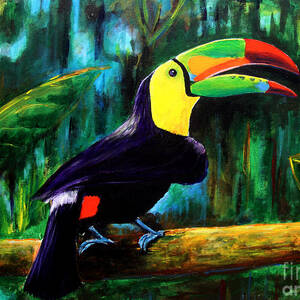
Find the location of a particular element. This screenshot has width=300, height=300. artwork is located at coordinates (150, 136).